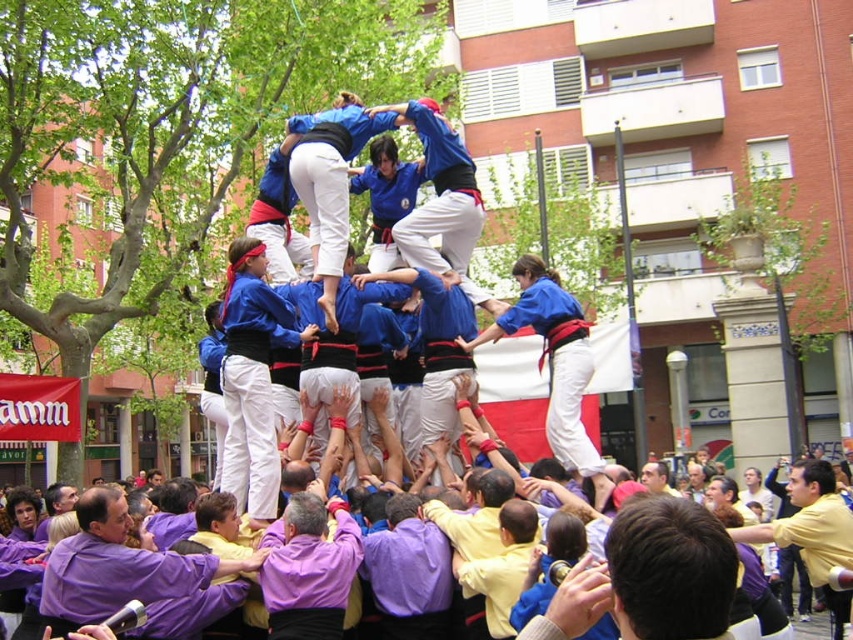
Who is positioned more to the right, purple cotton shirt at center or yellow matte shirt at center?

yellow matte shirt at center is more to the right.

Is purple cotton shirt at center to the right of yellow matte shirt at center from the viewer's perspective?

No, purple cotton shirt at center is not to the right of yellow matte shirt at center.

Find the location of a particular element. This screenshot has width=853, height=640. purple cotton shirt at center is located at coordinates (408, 572).

Where is `purple cotton shirt at center`? The height and width of the screenshot is (640, 853). purple cotton shirt at center is located at coordinates (408, 572).

Does point (83, 592) lie in front of point (647, 467)?

Yes, it is.

Is purple cotton shirt at lower left bigger than smooth yellow shirt at center?

Actually, purple cotton shirt at lower left might be smaller than smooth yellow shirt at center.

This screenshot has width=853, height=640. Identify the location of purple cotton shirt at lower left. (119, 566).

Is yellow matte shirt at center smaller than smooth yellow shirt at center?

No.

Is yellow matte shirt at center to the left of smooth yellow shirt at center from the viewer's perspective?

Incorrect, yellow matte shirt at center is not on the left side of smooth yellow shirt at center.

Does point (837, 531) come behind point (653, 465)?

No, it is not.

Where is `yellow matte shirt at center`? This screenshot has width=853, height=640. yellow matte shirt at center is located at coordinates (813, 532).